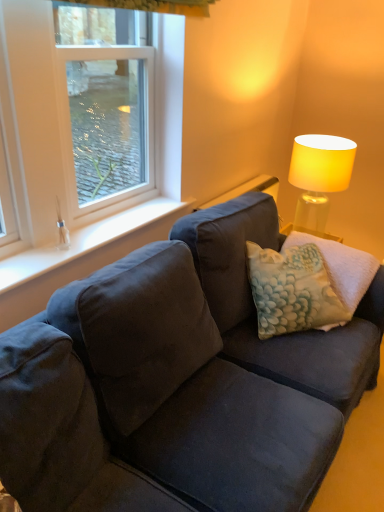
Question: Looking at the image, does white plastic window at upper left seem bigger or smaller compared to matte yellow fabric lampshade at upper right?

Choices:
 (A) big
 (B) small

Answer: (A)

Question: From their relative heights in the image, would you say white plastic window at upper left is taller or shorter than matte yellow fabric lampshade at upper right?

Choices:
 (A) tall
 (B) short

Answer: (A)

Question: Which object is the closest to the white smooth window sill at lower left?

Choices:
 (A) silky white curtain at upper center
 (B) textured cream pillow at center
 (C) white plastic window at upper left
 (D) matte yellow fabric lampshade at upper right

Answer: (C)

Question: Considering the real-world distances, which object is farthest from the textured cream pillow at center?

Choices:
 (A) white smooth window sill at lower left
 (B) silky white curtain at upper center
 (C) matte yellow fabric lampshade at upper right
 (D) white plastic window at upper left

Answer: (B)